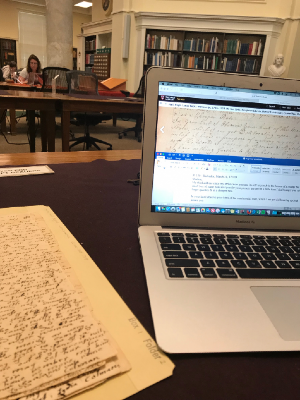
The height and width of the screenshot is (400, 300). Identify the location of paper with writing. (54, 316).